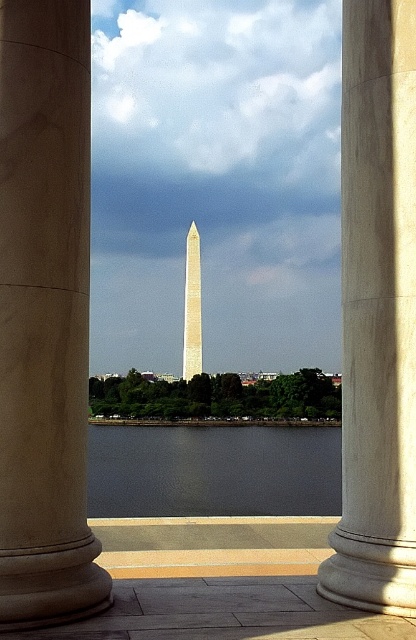
You are standing in front of the beige marble column at center and want to take a photo of the Washington Monument through the columns. If your camera is 5 meters away from you, will it be close enough to capture the scene through the columns?

The beige marble column at center and camera are 5.13 meters apart, so the camera is slightly farther than 5 meters away. Therefore, it will not be close enough to capture the scene through the columns.

You are a tour guide explaining the view from the columns to a visitor. The visitor asks how far apart the dark gray water at center and the white polished stone tower at center are. What do you tell them?

The dark gray water at center and the white polished stone tower at center are 43.22 meters apart.

Consider the image. You are standing in front of the two columns and want to take a photo of the Washington Monument. Which object in the scene takes up more area in the photo, the beige stone column at center or the dark gray water at center?

The dark gray water at center takes up more area in the photo than the beige stone column at center because the beige stone column at center occupies less space than dark gray water at center.